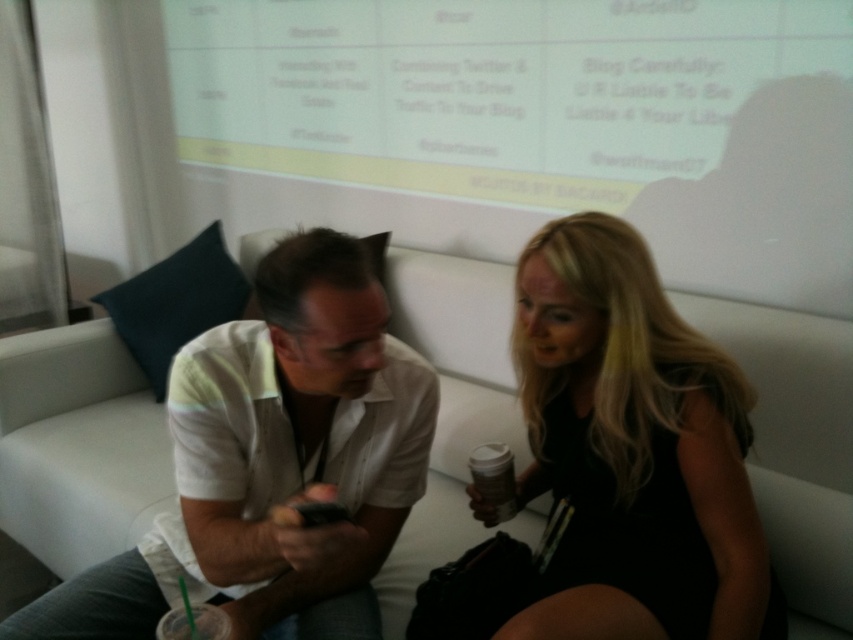
Can you confirm if white cotton shirt at center is positioned to the right of white matte cup at lower center?

In fact, white cotton shirt at center is to the left of white matte cup at lower center.

The image size is (853, 640). What are the coordinates of `white cotton shirt at center` in the screenshot? It's located at (274, 461).

What do you see at coordinates (274, 461) in the screenshot?
I see `white cotton shirt at center` at bounding box center [274, 461].

You are a GUI agent. You are given a task and a screenshot of the screen. Output one action in this format:
    pyautogui.click(x=<x>, y=<y>)
    Task: Click on the white cotton shirt at center
    Image resolution: width=853 pixels, height=640 pixels.
    Given the screenshot: What is the action you would take?
    pyautogui.click(x=274, y=461)

Can you confirm if white cotton shirt at center is taller than black matte dress at center?

In fact, white cotton shirt at center may be shorter than black matte dress at center.

Can you confirm if white cotton shirt at center is positioned to the left of black matte dress at center?

Yes, white cotton shirt at center is to the left of black matte dress at center.

You are a GUI agent. You are given a task and a screenshot of the screen. Output one action in this format:
    pyautogui.click(x=<x>, y=<y>)
    Task: Click on the white cotton shirt at center
    The width and height of the screenshot is (853, 640).
    Given the screenshot: What is the action you would take?
    pyautogui.click(x=274, y=461)

Who is positioned more to the right, black matte dress at center or white matte cup at lower center?

From the viewer's perspective, black matte dress at center appears more on the right side.

Which is in front, point (653, 625) or point (498, 522)?

Point (653, 625) is in front.

Which is behind, point (689, 477) or point (503, 464)?

Positioned behind is point (503, 464).

The height and width of the screenshot is (640, 853). I want to click on black matte dress at center, so click(x=631, y=451).